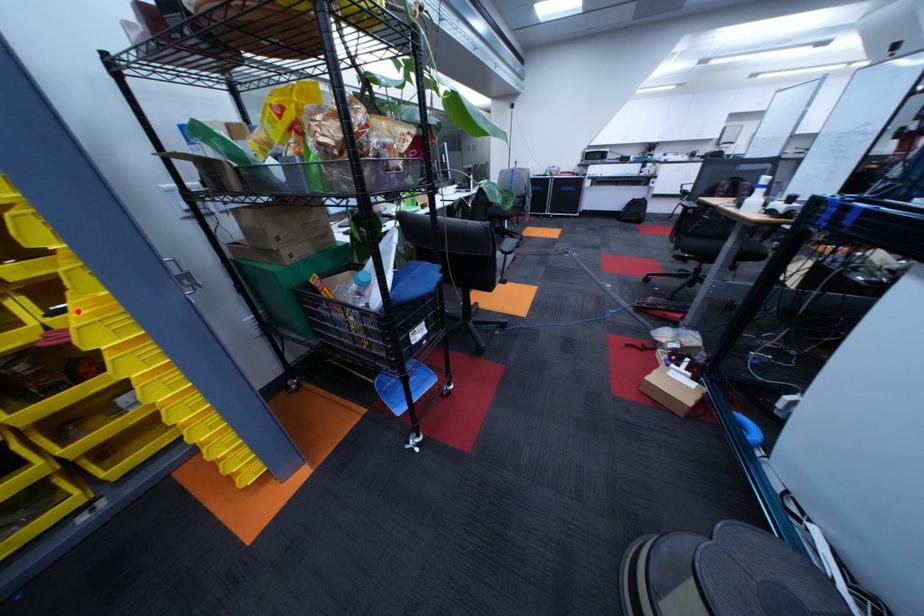
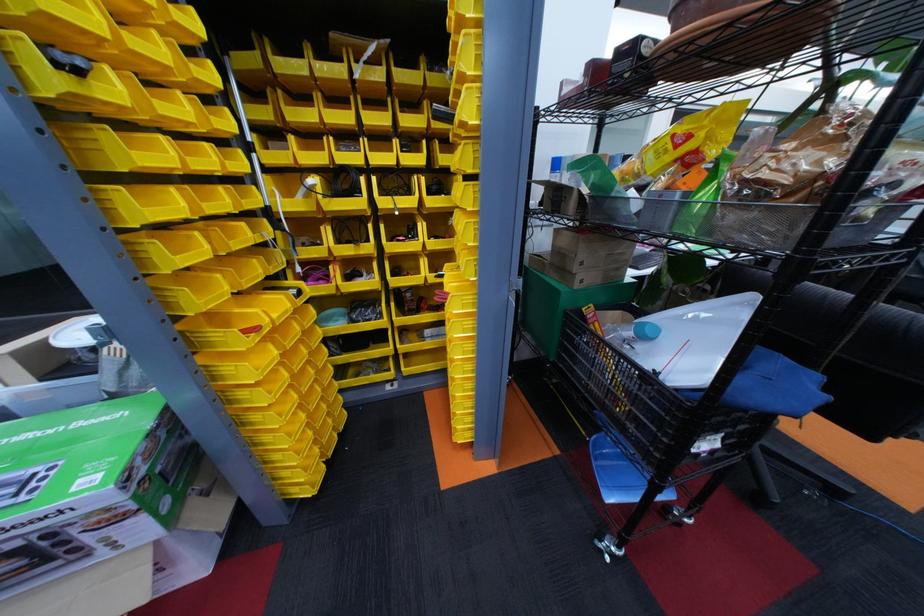
In the second image, find the point that corresponds to the highlighted location in the first image.

(456, 277)